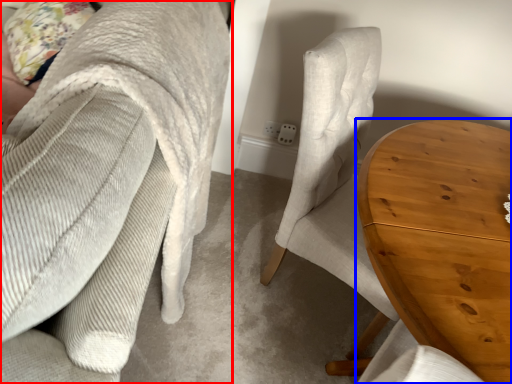
Question: Which point is further to the camera, chair (highlighted by a red box) or table (highlighted by a blue box)?

Choices:
 (A) chair
 (B) table

Answer: (B)